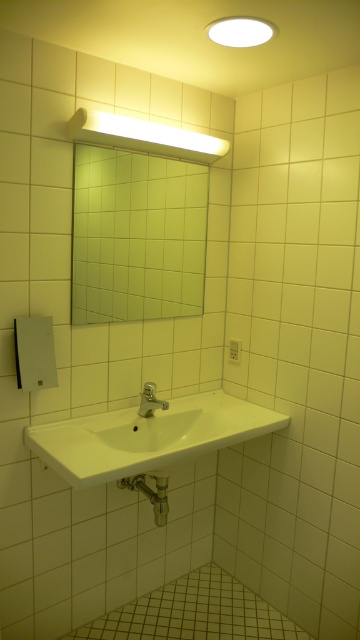
Is green tile mirror at upper center to the right of silver metallic faucet at sink center from the viewer's perspective?

Incorrect, green tile mirror at upper center is not on the right side of silver metallic faucet at sink center.

Between point (110, 157) and point (155, 410), which one is positioned in front?

Point (110, 157)

This screenshot has width=360, height=640. I want to click on green tile mirror at upper center, so click(x=137, y=236).

Is white glossy sink at center to the right of silver metallic faucet at sink center from the viewer's perspective?

Indeed, white glossy sink at center is positioned on the right side of silver metallic faucet at sink center.

Is the position of white glossy sink at center less distant than that of silver metallic faucet at sink center?

Yes, white glossy sink at center is in front of silver metallic faucet at sink center.

What do you see at coordinates (146, 436) in the screenshot?
I see `white glossy sink at center` at bounding box center [146, 436].

I want to click on white glossy sink at center, so click(146, 436).

Which is more to the left, green tile mirror at upper center or white glossy sink at center?

green tile mirror at upper center

Can you confirm if green tile mirror at upper center is shorter than white glossy sink at center?

In fact, green tile mirror at upper center may be taller than white glossy sink at center.

Between point (154, 211) and point (23, 436), which one is positioned in front?

Point (23, 436)

Identify the location of green tile mirror at upper center. (137, 236).